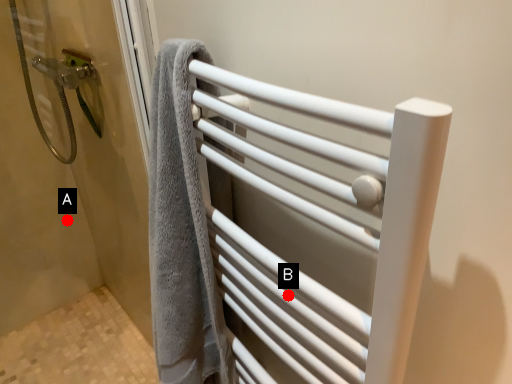
Question: Two points are circled on the image, labeled by A and B beside each circle. Which point is farther to the camera?

Choices:
 (A) A is further
 (B) B is further

Answer: (A)